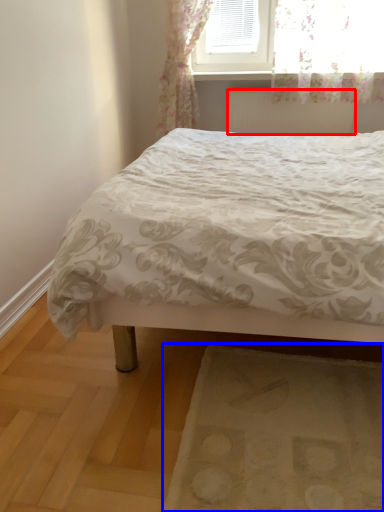
Question: Which point is further to the camera, radiator (highlighted by a red box) or mat (highlighted by a blue box)?

Choices:
 (A) radiator
 (B) mat

Answer: (A)